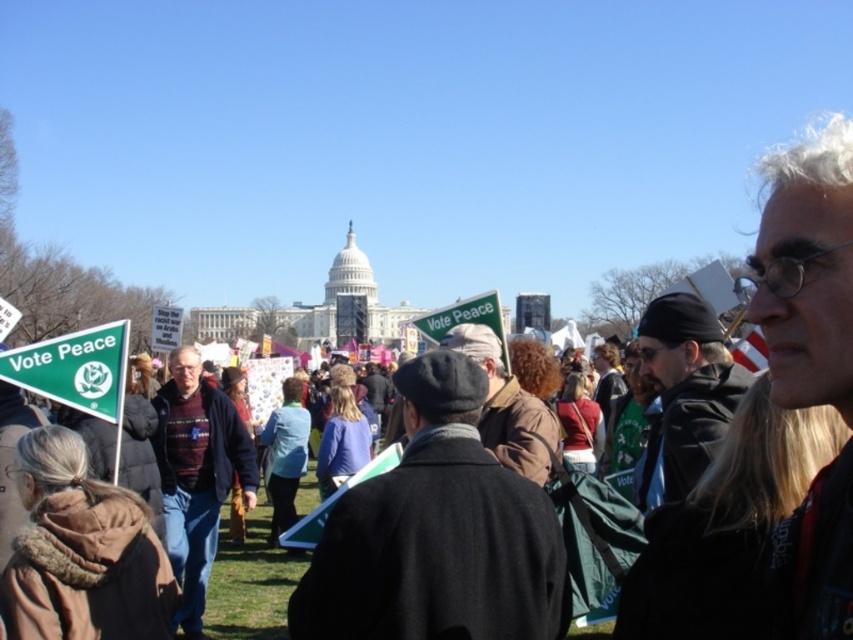
Is striped sweater at center positioned at the back of dark brown leather jacket at center?

Yes, striped sweater at center is behind dark brown leather jacket at center.

How much distance is there between striped sweater at center and dark brown leather jacket at center?

striped sweater at center and dark brown leather jacket at center are 79.51 meters apart from each other.

Where is `striped sweater at center`? The width and height of the screenshot is (853, 640). striped sweater at center is located at coordinates (196, 476).

Is dark gray wool coat at center to the left of brown leather jacket at center from the viewer's perspective?

Yes, dark gray wool coat at center is to the left of brown leather jacket at center.

From the picture: Is dark gray wool coat at center shorter than brown leather jacket at center?

Incorrect, dark gray wool coat at center's height does not fall short of brown leather jacket at center's.

Is point (424, 545) closer to viewer compared to point (558, 440)?

Yes, it is.

At what (x,y) coordinates should I click in order to perform the action: click on dark gray wool coat at center. Please return your answer as a coordinate pair (x, y). This screenshot has height=640, width=853. Looking at the image, I should click on pos(437,532).

Who is positioned more to the left, dark gray wool coat at center or white hair at center?

Positioned to the left is dark gray wool coat at center.

Locate an element on the screen. The image size is (853, 640). dark gray wool coat at center is located at coordinates 437,532.